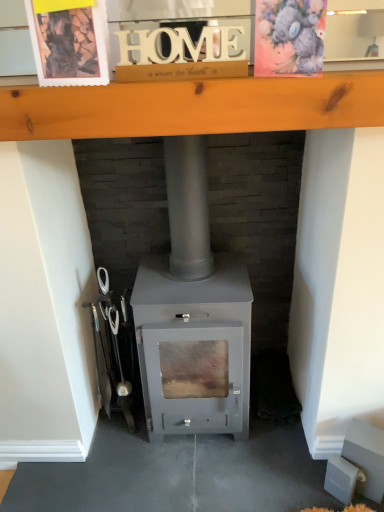
Question: Looking at the image, does watercolor paper postcard at upper right, the 1th postcard in the right-to-left sequence, seem bigger or smaller compared to matte gray wood burning stove at center?

Choices:
 (A) small
 (B) big

Answer: (A)

Question: From the image's perspective, is watercolor paper postcard at upper right, the 1th postcard in the right-to-left sequence, above or below matte gray wood burning stove at center?

Choices:
 (A) above
 (B) below

Answer: (A)

Question: Which of these objects is positioned farthest from the wooden postcard at upper left, the second postcard viewed from the right?

Choices:
 (A) matte gray wood burning stove at center
 (B) wooden at upper center
 (C) watercolor paper postcard at upper right, the 1th postcard in the right-to-left sequence

Answer: (A)

Question: Considering the real-world distances, which object is farthest from the matte gray wood burning stove at center?

Choices:
 (A) watercolor paper postcard at upper right, the 1th postcard in the right-to-left sequence
 (B) wooden at upper center
 (C) wooden postcard at upper left, acting as the 1th postcard starting from the left

Answer: (A)